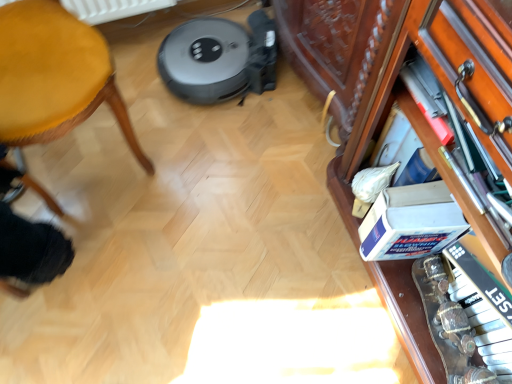
Question: Can you confirm if wooden piano keys at right is smaller than wooden drawer at right?

Choices:
 (A) yes
 (B) no

Answer: (B)

Question: From a real-world perspective, is wooden piano keys at right below wooden drawer at right?

Choices:
 (A) no
 (B) yes

Answer: (B)

Question: Is wooden piano keys at right oriented towards wooden drawer at right?

Choices:
 (A) no
 (B) yes

Answer: (A)

Question: Is wooden piano keys at right closer to the viewer compared to wooden drawer at right?

Choices:
 (A) yes
 (B) no

Answer: (B)

Question: Is there a large distance between wooden piano keys at right and wooden drawer at right?

Choices:
 (A) no
 (B) yes

Answer: (A)

Question: Is wooden piano keys at right bigger than wooden drawer at right?

Choices:
 (A) no
 (B) yes

Answer: (B)

Question: Is white cardboard box at lower right further to camera compared to yellow fabric stool at left?

Choices:
 (A) yes
 (B) no

Answer: (A)

Question: From the image's perspective, is white cardboard box at lower right over yellow fabric stool at left?

Choices:
 (A) yes
 (B) no

Answer: (B)

Question: Is white cardboard box at lower right not within yellow fabric stool at left?

Choices:
 (A) no
 (B) yes

Answer: (B)

Question: Considering the relative positions of white cardboard box at lower right and yellow fabric stool at left in the image provided, is white cardboard box at lower right to the right of yellow fabric stool at left from the viewer's perspective?

Choices:
 (A) yes
 (B) no

Answer: (A)

Question: From a real-world perspective, is white cardboard box at lower right below yellow fabric stool at left?

Choices:
 (A) yes
 (B) no

Answer: (A)

Question: Considering the relative sizes of white cardboard box at lower right and yellow fabric stool at left in the image provided, is white cardboard box at lower right taller than yellow fabric stool at left?

Choices:
 (A) yes
 (B) no

Answer: (B)

Question: From a real-world perspective, does yellow fabric stool at left stand above wooden drawer at right?

Choices:
 (A) yes
 (B) no

Answer: (B)